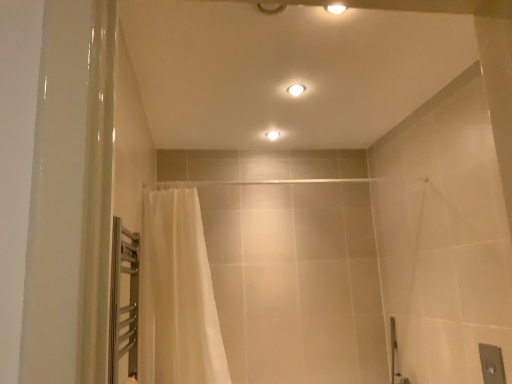
Question: Would you say white sheer curtain at left contains matte white ceiling light at center, arranged as the 2th light fixture when viewed from the front?

Choices:
 (A) no
 (B) yes

Answer: (A)

Question: Is white sheer curtain at left smaller than matte white ceiling light at center, arranged as the 2th light fixture when viewed from the front?

Choices:
 (A) yes
 (B) no

Answer: (B)

Question: Is white sheer curtain at left taller than matte white ceiling light at center, arranged as the 2th light fixture when viewed from the front?

Choices:
 (A) no
 (B) yes

Answer: (B)

Question: Does white sheer curtain at left have a lesser width compared to matte white ceiling light at center, marked as the 1th light fixture in a bottom-to-top arrangement?

Choices:
 (A) no
 (B) yes

Answer: (A)

Question: From a real-world perspective, does white sheer curtain at left sit lower than matte white ceiling light at center, arranged as the 2th light fixture when viewed from the front?

Choices:
 (A) yes
 (B) no

Answer: (A)

Question: Looking at their shapes, would you say white glossy light fixture at upper center, placed as the second light fixture when sorted from bottom to top, is wider or thinner than matte white ceiling light at center, marked as the 1th light fixture in a bottom-to-top arrangement?

Choices:
 (A) wide
 (B) thin

Answer: (A)

Question: Considering the positions of white glossy light fixture at upper center, placed as the 2th light fixture when sorted from left to right, and matte white ceiling light at center, which is the 2th light fixture from top to bottom, in the image, is white glossy light fixture at upper center, placed as the 2th light fixture when sorted from left to right, bigger or smaller than matte white ceiling light at center, which is the 2th light fixture from top to bottom,?

Choices:
 (A) big
 (B) small

Answer: (A)

Question: Is white glossy light fixture at upper center, which is the 1th light fixture from top to bottom, taller or shorter than matte white ceiling light at center, which is the 2th light fixture in right-to-left order?

Choices:
 (A) short
 (B) tall

Answer: (B)

Question: Is white glossy light fixture at upper center, placed as the 2th light fixture when sorted from left to right, in front of or behind matte white ceiling light at center, which is the 2th light fixture in right-to-left order, in the image?

Choices:
 (A) front
 (B) behind

Answer: (A)

Question: Is point (290, 91) closer or farther from the camera than point (172, 251)?

Choices:
 (A) closer
 (B) farther

Answer: (B)

Question: Is white glossy light fixture at upper center, which is the 1th light fixture from top to bottom, wider or thinner than white sheer curtain at left?

Choices:
 (A) wide
 (B) thin

Answer: (B)

Question: Is white glossy light fixture at upper center, placed as the second light fixture when sorted from bottom to top, bigger or smaller than white sheer curtain at left?

Choices:
 (A) small
 (B) big

Answer: (A)

Question: Based on their positions, is white glossy light fixture at upper center, the 2th light fixture from the back, located to the left or right of white sheer curtain at left?

Choices:
 (A) left
 (B) right

Answer: (B)

Question: In terms of size, does white sheer curtain at left appear bigger or smaller than matte white ceiling light at center, which is the 2th light fixture in right-to-left order?

Choices:
 (A) small
 (B) big

Answer: (B)

Question: Is point (193, 332) positioned closer to the camera than point (276, 134)?

Choices:
 (A) closer
 (B) farther

Answer: (A)